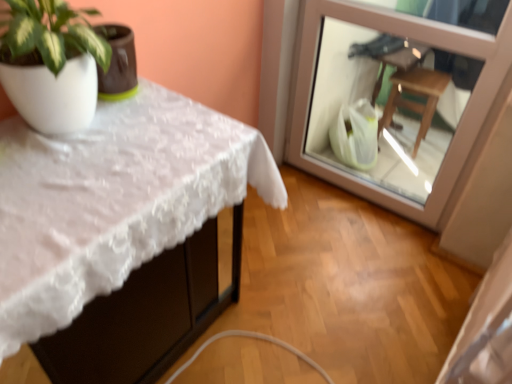
Question: In terms of size, does transparent glass door at upper right appear bigger or smaller than white lace tablecloth at upper left?

Choices:
 (A) small
 (B) big

Answer: (A)

Question: Would you say transparent glass door at upper right is to the left or to the right of white lace tablecloth at upper left in the picture?

Choices:
 (A) left
 (B) right

Answer: (B)

Question: From the image's perspective, is transparent glass door at upper right located above or below white lace tablecloth at upper left?

Choices:
 (A) above
 (B) below

Answer: (A)

Question: Is white lace tablecloth at upper left taller or shorter than transparent glass door at upper right?

Choices:
 (A) short
 (B) tall

Answer: (A)

Question: Is white lace tablecloth at upper left wider or thinner than transparent glass door at upper right?

Choices:
 (A) wide
 (B) thin

Answer: (A)

Question: Would you say white lace tablecloth at upper left is to the left or to the right of transparent glass door at upper right in the picture?

Choices:
 (A) right
 (B) left

Answer: (B)

Question: Considering the positions of point (142, 304) and point (316, 31), is point (142, 304) closer or farther from the camera than point (316, 31)?

Choices:
 (A) farther
 (B) closer

Answer: (B)